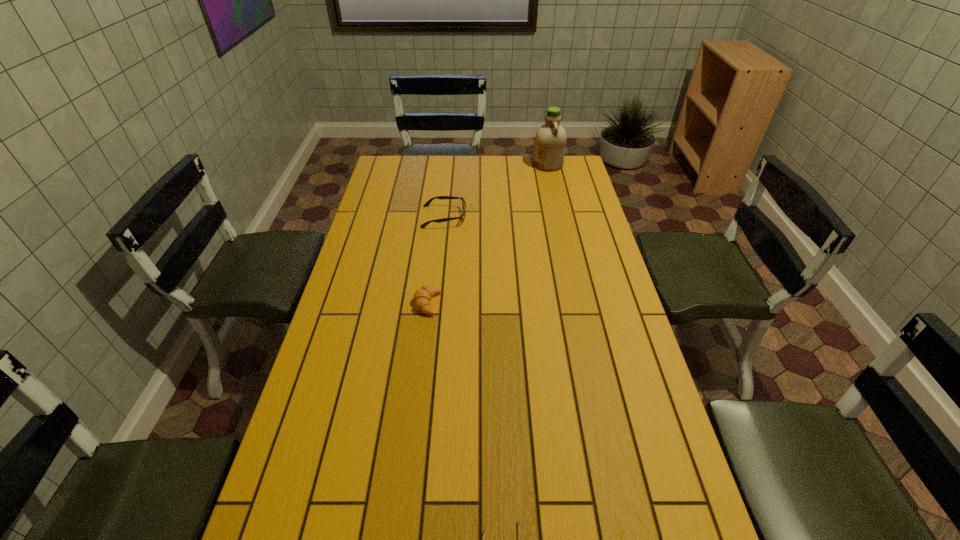
Find the location of a particular element. free space between the crescent roll and the tallest object is located at coordinates (488, 234).

This screenshot has height=540, width=960. Find the location of `free space between the third farthest object and the farthest object`. free space between the third farthest object and the farthest object is located at coordinates (488, 234).

You are a GUI agent. You are given a task and a screenshot of the screen. Output one action in this format:
    pyautogui.click(x=<x>, y=<y>)
    Task: Click on the closest object relative to the shortest object
    
    Given the screenshot: What is the action you would take?
    pyautogui.click(x=422, y=297)

What are the coordinates of `object that is the closest to the rightmost object` in the screenshot? It's located at (428, 202).